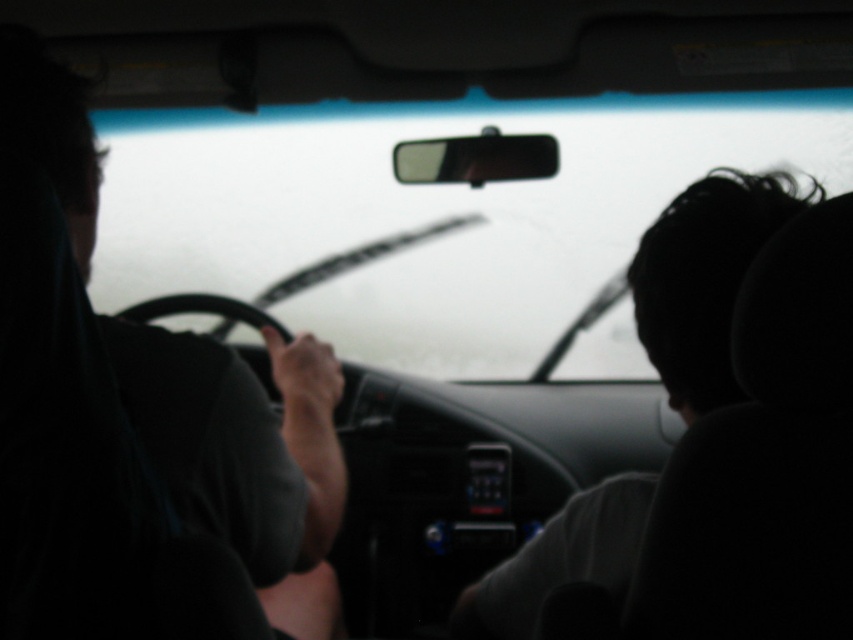
Which is above, dark matte shirt at left or dark hair at right?

dark matte shirt at left is higher up.

From the picture: Can you confirm if dark matte shirt at left is bigger than dark hair at right?

Yes.

Find the location of a particular element. This screenshot has height=640, width=853. dark matte shirt at left is located at coordinates (245, 456).

Locate an element on the screen. The width and height of the screenshot is (853, 640). dark matte shirt at left is located at coordinates (245, 456).

Between transparent glass windshield at center and dark hair at right, which one appears on the left side from the viewer's perspective?

From the viewer's perspective, transparent glass windshield at center appears more on the left side.

Does transparent glass windshield at center appear under dark hair at right?

Answer: Incorrect, transparent glass windshield at center is not positioned below dark hair at right.

Image resolution: width=853 pixels, height=640 pixels. In order to click on transparent glass windshield at center in this screenshot , I will do `click(427, 212)`.

Is point (358, 316) positioned in front of point (309, 612)?

No.

Who is positioned more to the left, transparent glass windshield at center or dark matte shirt at left?

From the viewer's perspective, dark matte shirt at left appears more on the left side.

This screenshot has height=640, width=853. I want to click on transparent glass windshield at center, so click(427, 212).